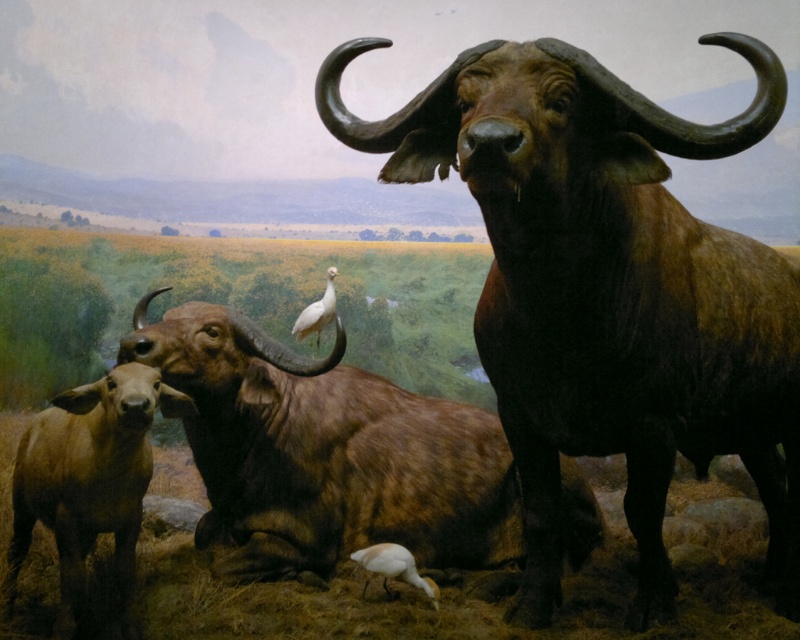
You are a museum guide explaining the exhibit layout. A visitor asks, which object is positioned at the coordinates point 0.708, 0.409? Mention all relevant objects from the list below in your answer. Objects available for selection are brown matte yak at center and green marble statue at lower right.

The brown matte yak at center is located at point (326, 452).

You are standing in front of the museum exhibit and want to touch the point at coordinates [540,364]. Is this point within arm reach? Assume your arm can extend 3 feet.

The point at [540,364] is 8.33 feet away from the viewer, which is farther than the arm can reach. You cannot touch it with your arm extended 3 feet.